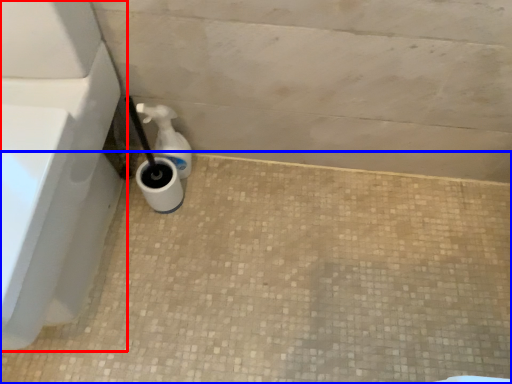
Question: Which of the following is the closest to the observer, bath (highlighted by a red box) or concrete (highlighted by a blue box)?

Choices:
 (A) bath
 (B) concrete

Answer: (A)